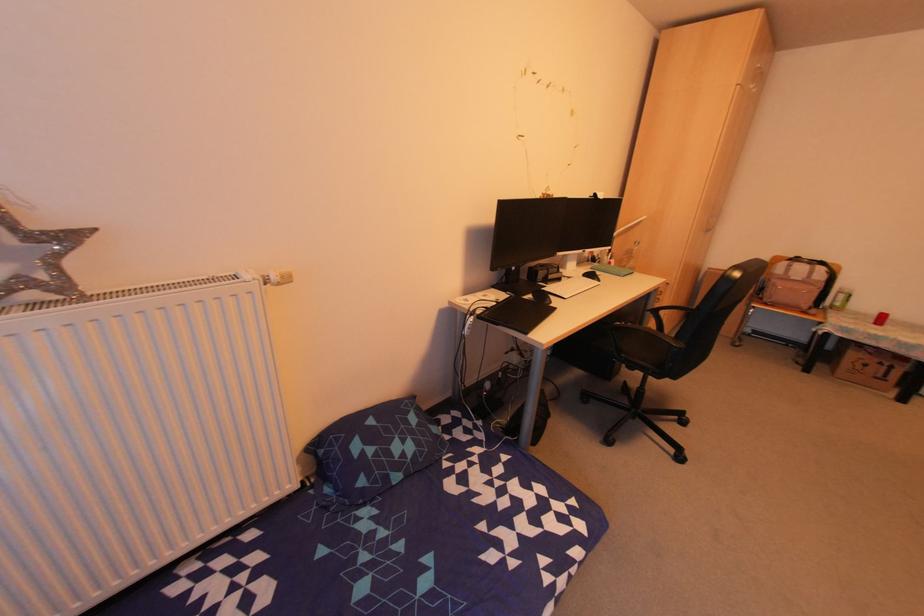
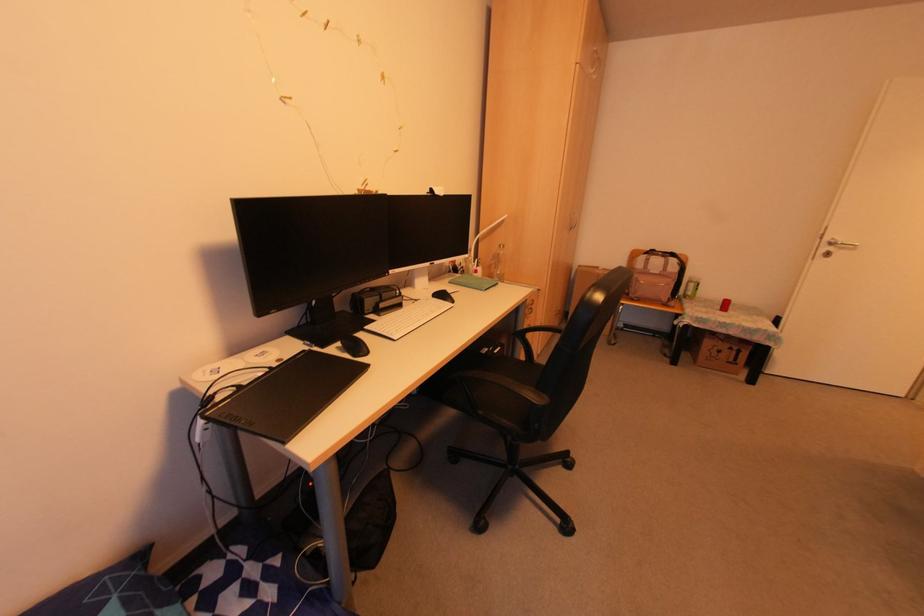
Where in the second image is the point corresponding to [546,83] from the first image?

(324, 22)